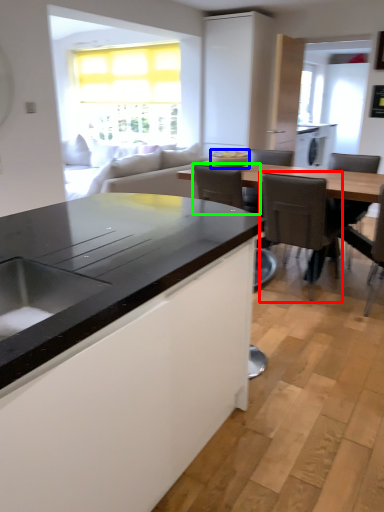
Question: Which is nearer to the chair (highlighted by a red box)? appliance (highlighted by a blue box) or armchair (highlighted by a green box).

Choices:
 (A) appliance
 (B) armchair

Answer: (B)